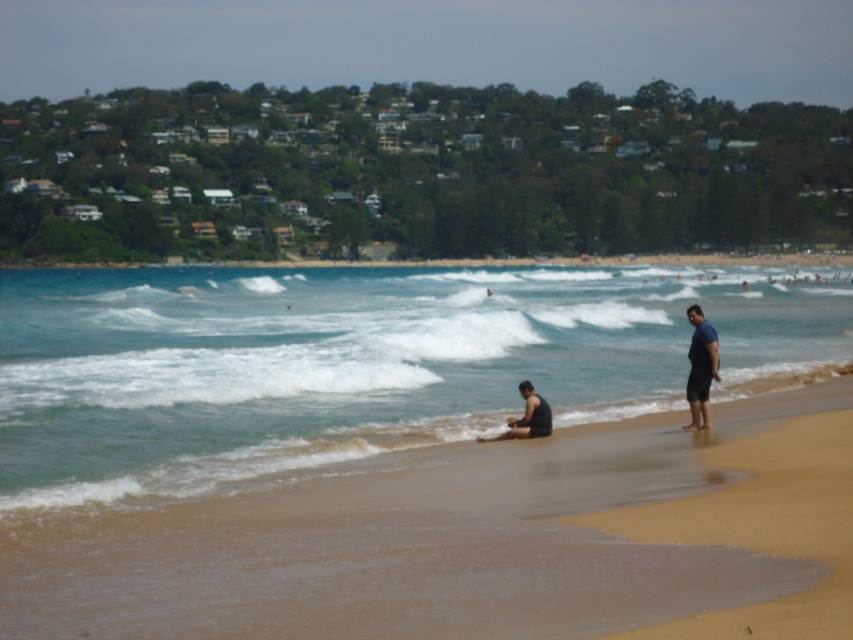
You are planning to set up a small tent on the brown sandy beach at lower center. Considering the presence of the black matte shirt at lower center, will there be enough space for the tent? Please explain your reasoning.

The brown sandy beach at lower center has a larger width than the black matte shirt at lower center. Since the beach area is wider, there should be sufficient space to set up the tent as long as it is placed away from the shirt.

You are a photographer trying to capture a candid shot of the beach scene. You notice the blue fabric shorts at right and the black matte shirt at lower center. Which object is taller in the image?

The blue fabric shorts at right is taller than the black matte shirt at lower center according to the description.